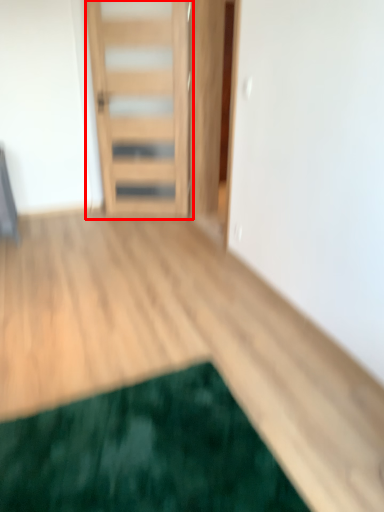
Question: In this image, where is door (annotated by the red box) located relative to mat?

Choices:
 (A) left
 (B) right

Answer: (A)